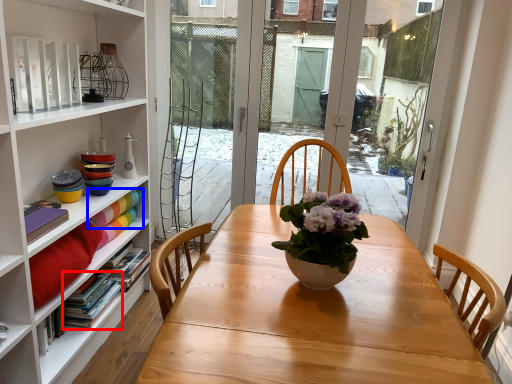
Question: Which of the following is the farthest to the observer, book (highlighted by a red box) or book (highlighted by a blue box)?

Choices:
 (A) book
 (B) book

Answer: (B)